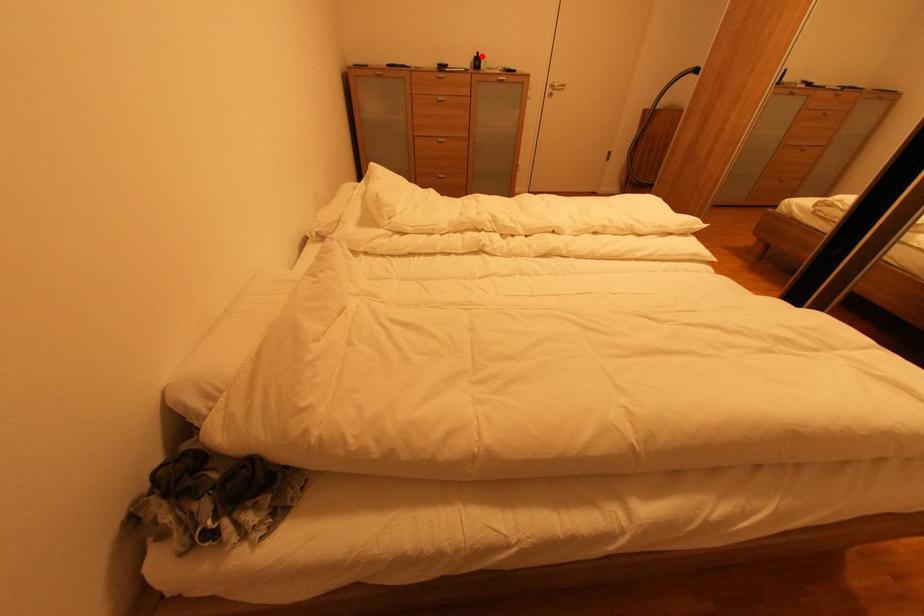
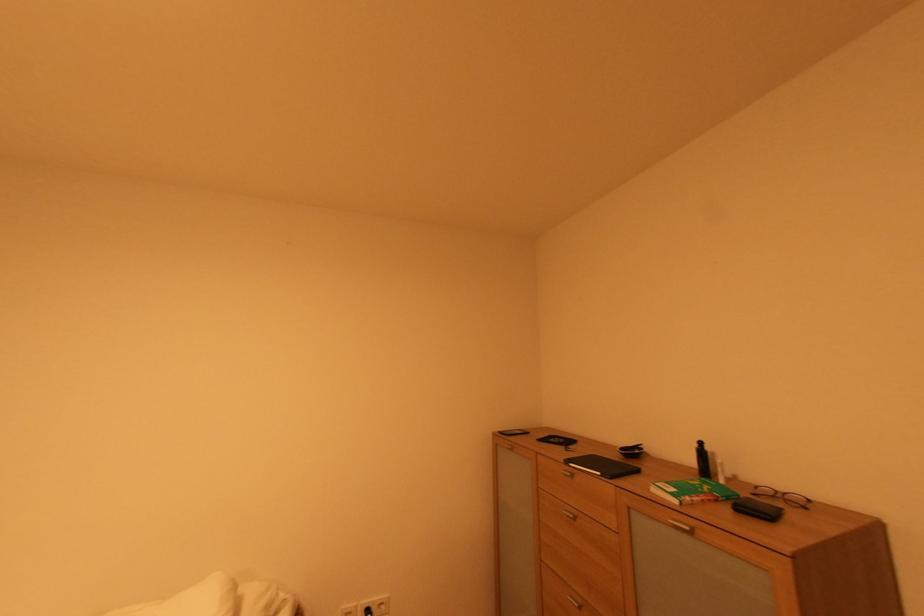
Locate, in the second image, the point that corresponds to the highlighted location in the first image.

(701, 447)